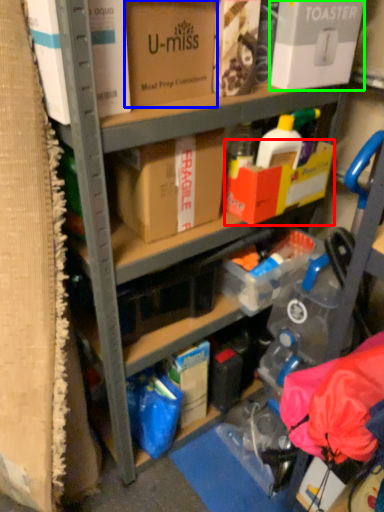
Question: Considering the real-world distances, which object is closest to box (highlighted by a red box)? box (highlighted by a blue box) or box (highlighted by a green box).

Choices:
 (A) box
 (B) box

Answer: (B)